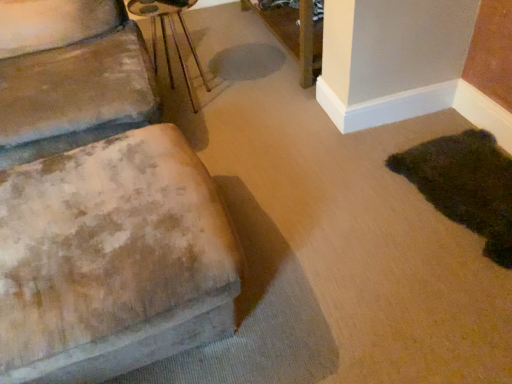
Question: Would you say metallic silver side table at upper center is outside wooden table at upper center?

Choices:
 (A) yes
 (B) no

Answer: (A)

Question: Can you confirm if metallic silver side table at upper center is smaller than wooden table at upper center?

Choices:
 (A) yes
 (B) no

Answer: (A)

Question: From a real-world perspective, is metallic silver side table at upper center positioned over wooden table at upper center based on gravity?

Choices:
 (A) yes
 (B) no

Answer: (A)

Question: From a real-world perspective, is metallic silver side table at upper center beneath wooden table at upper center?

Choices:
 (A) yes
 (B) no

Answer: (B)

Question: Is metallic silver side table at upper center shorter than wooden table at upper center?

Choices:
 (A) yes
 (B) no

Answer: (B)

Question: Is the surface of metallic silver side table at upper center in direct contact with wooden table at upper center?

Choices:
 (A) no
 (B) yes

Answer: (A)

Question: Is dark green plush rug at lower right closer to the viewer compared to wooden table at upper center?

Choices:
 (A) no
 (B) yes

Answer: (B)

Question: Is dark green plush rug at lower right wider than wooden table at upper center?

Choices:
 (A) yes
 (B) no

Answer: (A)

Question: Is dark green plush rug at lower right in contact with wooden table at upper center?

Choices:
 (A) no
 (B) yes

Answer: (A)

Question: Considering the relative sizes of dark green plush rug at lower right and wooden table at upper center in the image provided, is dark green plush rug at lower right taller than wooden table at upper center?

Choices:
 (A) no
 (B) yes

Answer: (A)

Question: Is dark green plush rug at lower right oriented away from wooden table at upper center?

Choices:
 (A) no
 (B) yes

Answer: (A)

Question: Considering the relative sizes of dark green plush rug at lower right and wooden table at upper center in the image provided, is dark green plush rug at lower right smaller than wooden table at upper center?

Choices:
 (A) no
 (B) yes

Answer: (B)

Question: Can you confirm if metallic silver side table at upper center is smaller than worn fabric ottoman at left?

Choices:
 (A) yes
 (B) no

Answer: (A)